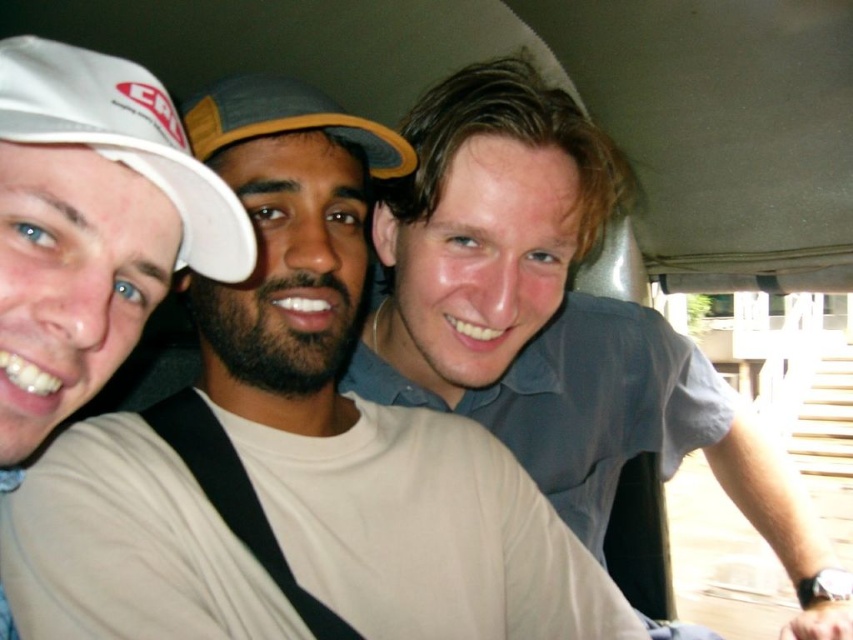
Question: Can you confirm if white fabric cap at left is wider than gray fabric baseball cap at center?

Choices:
 (A) no
 (B) yes

Answer: (A)

Question: Which point is farther to the camera?

Choices:
 (A) white matte cap at left
 (B) white fabric cap at left

Answer: (A)

Question: Which point is farther to the camera?

Choices:
 (A) white matte cap at left
 (B) white fabric cap at left
 (C) gray fabric baseball cap at center

Answer: (C)

Question: Among these points, which one is nearest to the camera?

Choices:
 (A) (199, 166)
 (B) (254, 84)

Answer: (A)

Question: Does white matte cap at left have a lesser width compared to white fabric cap at left?

Choices:
 (A) no
 (B) yes

Answer: (A)

Question: Does white fabric cap at left appear under gray fabric baseball cap at center?

Choices:
 (A) no
 (B) yes

Answer: (B)